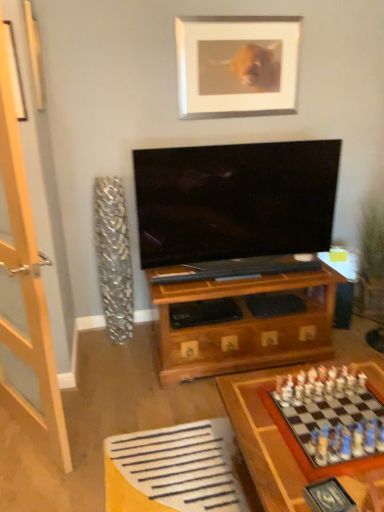
In order to face silver metallic picture frame at upper center, should I rotate leftwards or rightwards?

Rotate right and turn 6.601 degrees.

Find the location of `wooden chess set at lower right`. wooden chess set at lower right is located at coordinates (329, 420).

Locate an element on the screen. This screenshot has width=384, height=512. wooden chessboard at lower right is located at coordinates (262, 439).

Can you confirm if silver metallic picture frame at upper center is wider than clear glass door at left?

No, silver metallic picture frame at upper center is not wider than clear glass door at left.

In the image, is silver metallic picture frame at upper center positioned in front of or behind clear glass door at left?

In the image, silver metallic picture frame at upper center appears behind clear glass door at left.

How different are the orientations of silver metallic picture frame at upper center and clear glass door at left in degrees?

55.6 degrees separate the facing orientations of silver metallic picture frame at upper center and clear glass door at left.

From the image's perspective, is silver metallic picture frame at upper center over clear glass door at left?

Yes.

Considering the positions of objects wooden chessboard at lower right and silver metallic picture frame at upper center in the image provided, who is more to the right, wooden chessboard at lower right or silver metallic picture frame at upper center?

Positioned to the right is wooden chessboard at lower right.

Does wooden chessboard at lower right touch silver metallic picture frame at upper center?

No, wooden chessboard at lower right is not touching silver metallic picture frame at upper center.

Is wooden chessboard at lower right shorter than silver metallic picture frame at upper center?

Correct, wooden chessboard at lower right is not as tall as silver metallic picture frame at upper center.

From a real-world perspective, relative to wooden chess set at lower right, is clear glass door at left vertically above or below?

Clearly, from a real-world perspective, clear glass door at left is above wooden chess set at lower right.

Based on the photo, is clear glass door at left aimed at wooden chess set at lower right?

No, clear glass door at left is not turned towards wooden chess set at lower right.

From the image's perspective, which is below, clear glass door at left or wooden chess set at lower right?

wooden chess set at lower right is shown below in the image.

Considering the sizes of objects wooden chess set at lower right and silver metallic picture frame at upper center in the image provided, who is smaller, wooden chess set at lower right or silver metallic picture frame at upper center?

wooden chess set at lower right is smaller.

Consider the image. From the image's perspective, is wooden chess set at lower right located beneath silver metallic picture frame at upper center?

Yes.

Which of these two, wooden chess set at lower right or silver metallic picture frame at upper center, is thinner?

silver metallic picture frame at upper center is thinner.

Is there a large distance between wooden chess set at lower right and silver metallic picture frame at upper center?

Yes, wooden chess set at lower right and silver metallic picture frame at upper center are quite far apart.

From the image's perspective, which one is positioned lower, silver metallic picture frame at upper center or wooden chessboard at lower right?

wooden chessboard at lower right is shown below in the image.

Based on the photo, is wooden chessboard at lower right at the back of silver metallic picture frame at upper center?

No, silver metallic picture frame at upper center is not facing away from wooden chessboard at lower right.

Do you think silver metallic picture frame at upper center is within wooden chessboard at lower right, or outside of it?

silver metallic picture frame at upper center is not enclosed by wooden chessboard at lower right.

Considering the positions of objects wooden chessboard at lower right and clear glass door at left in the image provided, who is more to the left, wooden chessboard at lower right or clear glass door at left?

clear glass door at left.

Between wooden chessboard at lower right and clear glass door at left, which one has smaller size?

With smaller size is clear glass door at left.

Locate an element on the screen. This screenshot has width=384, height=512. table on the right side of wooden chess set at lower right is located at coordinates (262, 439).

From the image's perspective, which object appears higher, wooden chess set at lower right or wooden chessboard at lower right?

wooden chess set at lower right.

From a real-world perspective, which is physically below, wooden chess set at lower right or wooden chessboard at lower right?

wooden chessboard at lower right is physically lower.

How many degrees apart are the facing directions of wooden chess set at lower right and wooden chessboard at lower right?

The facing directions of wooden chess set at lower right and wooden chessboard at lower right are 90.7 degrees apart.

Identify the location of glass door below the silver metallic picture frame at upper center (from the image's perspective). The width and height of the screenshot is (384, 512). (27, 285).

Identify the location of picture frame that is above the wooden chessboard at lower right (from the image's perspective). The image size is (384, 512). (236, 66).

From the image, which object appears to be farther from silver metallic picture frame at upper center, wooden chessboard at lower right or wooden chess set at lower right?

Based on the image, wooden chess set at lower right appears to be further to silver metallic picture frame at upper center.

Based on their spatial positions, is clear glass door at left or silver metallic picture frame at upper center further from wooden chess set at lower right?

Based on the image, silver metallic picture frame at upper center appears to be further to wooden chess set at lower right.

Estimate the real-world distances between objects in this image. Which object is closer to wooden chessboard at lower right, clear glass door at left or silver metallic picture frame at upper center?

clear glass door at left is closer to wooden chessboard at lower right.

Which object lies further to the anchor point silver metallic picture frame at upper center, clear glass door at left or wooden chessboard at lower right?

wooden chessboard at lower right lies further to silver metallic picture frame at upper center than the other object.

Which object lies nearer to the anchor point wooden chessboard at lower right, silver metallic picture frame at upper center or clear glass door at left?

clear glass door at left is closer to wooden chessboard at lower right.

When comparing their distances from clear glass door at left, does wooden chess set at lower right or wooden chessboard at lower right seem further?

wooden chess set at lower right is further to clear glass door at left.

Which object lies nearer to the anchor point clear glass door at left, wooden chessboard at lower right or silver metallic picture frame at upper center?

wooden chessboard at lower right.

Based on their spatial positions, is wooden chess set at lower right or clear glass door at left closer to silver metallic picture frame at upper center?

clear glass door at left lies closer to silver metallic picture frame at upper center than the other object.

This screenshot has width=384, height=512. What are the coordinates of `board game between silver metallic picture frame at upper center and wooden chessboard at lower right vertically` in the screenshot? It's located at (329, 420).

This screenshot has width=384, height=512. I want to click on glass door between silver metallic picture frame at upper center and wooden chess set at lower right vertically, so click(27, 285).

This screenshot has height=512, width=384. Identify the location of board game between clear glass door at left and wooden chessboard at lower right from left to right. (329, 420).

I want to click on glass door between silver metallic picture frame at upper center and wooden chessboard at lower right in the vertical direction, so click(27, 285).